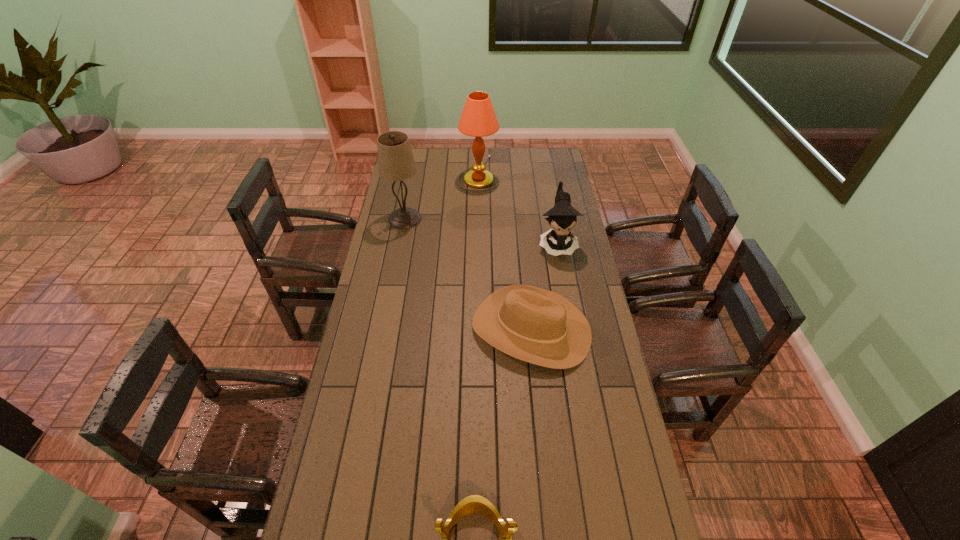
Where is `vacant area that lies between the cowboy hat and the third tallest object`? This screenshot has width=960, height=540. vacant area that lies between the cowboy hat and the third tallest object is located at coordinates (544, 286).

Where is `vacant area that lies between the third tallest object and the farthest object`? This screenshot has height=540, width=960. vacant area that lies between the third tallest object and the farthest object is located at coordinates (517, 208).

What are the coordinates of `empty space that is in between the leftmost object and the lamp` in the screenshot? It's located at (442, 195).

Identify the location of free space between the lamp and the lampshade. The width and height of the screenshot is (960, 540). (442, 195).

Identify the location of empty space that is in between the second nearest object and the leftmost object. The width and height of the screenshot is (960, 540). (468, 274).

Locate an element on the screen. This screenshot has height=540, width=960. empty space between the lamp and the third shortest object is located at coordinates (517, 208).

Where is `object that stands as the second closest to the tiara`? object that stands as the second closest to the tiara is located at coordinates [562, 217].

The height and width of the screenshot is (540, 960). I want to click on object that is the third closest one to the second shortest object, so click(x=396, y=162).

I want to click on blank space that satisfies the following two spatial constraints: 1. on the front-facing side of the lampshade; 2. on the back side of the fourth farthest object, so click(x=384, y=329).